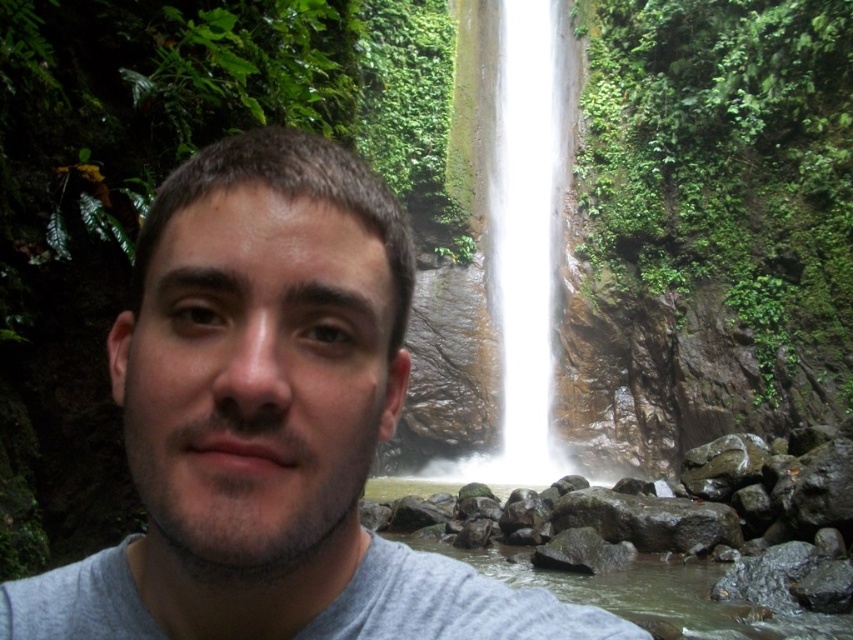
Question: Among these objects, which one is farthest from the camera?

Choices:
 (A) gray cotton shirt at center
 (B) white smooth waterfall at center

Answer: (B)

Question: Which object is farther from the camera taking this photo?

Choices:
 (A) gray cotton shirt at center
 (B) white smooth waterfall at center

Answer: (B)

Question: Does gray cotton shirt at center have a larger size compared to white smooth waterfall at center?

Choices:
 (A) no
 (B) yes

Answer: (A)

Question: Is gray cotton shirt at center positioned in front of white smooth waterfall at center?

Choices:
 (A) yes
 (B) no

Answer: (A)

Question: Where is gray cotton shirt at center located in relation to white smooth waterfall at center in the image?

Choices:
 (A) left
 (B) right

Answer: (A)